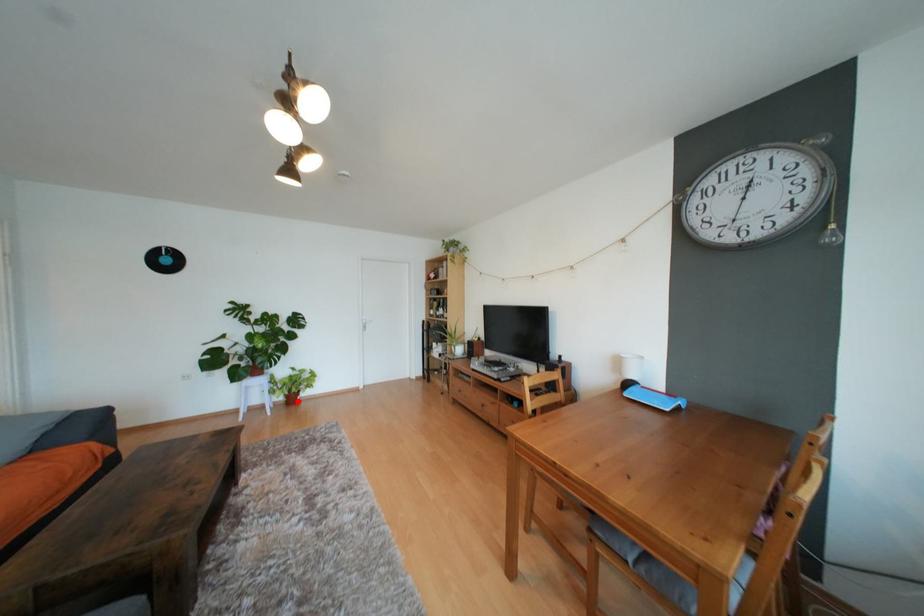
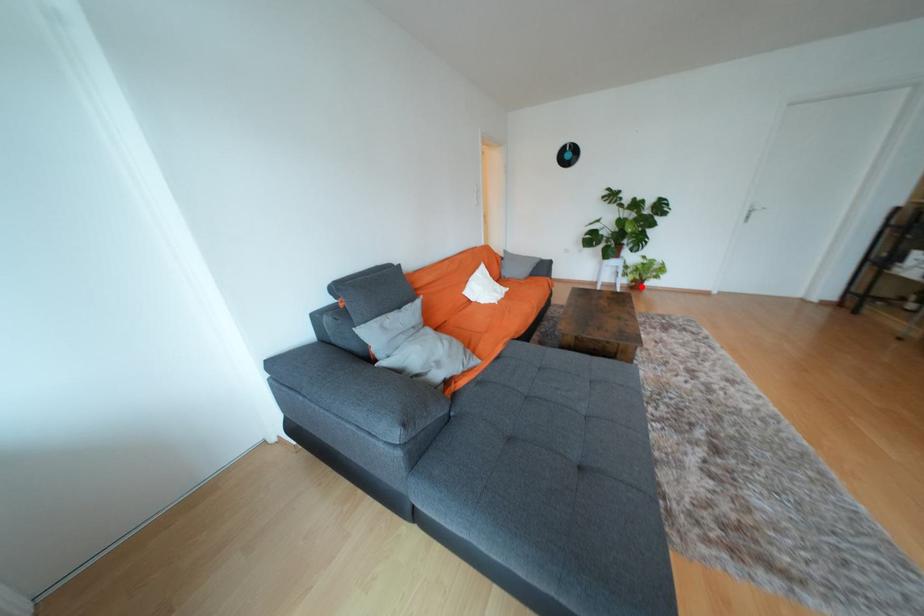
I am providing you with two images of the same scene from different viewpoints. A red point is marked on the first image and another point is marked on the second image. Is the marked point in image1 the same physical position as the marked point in image2?

Yes